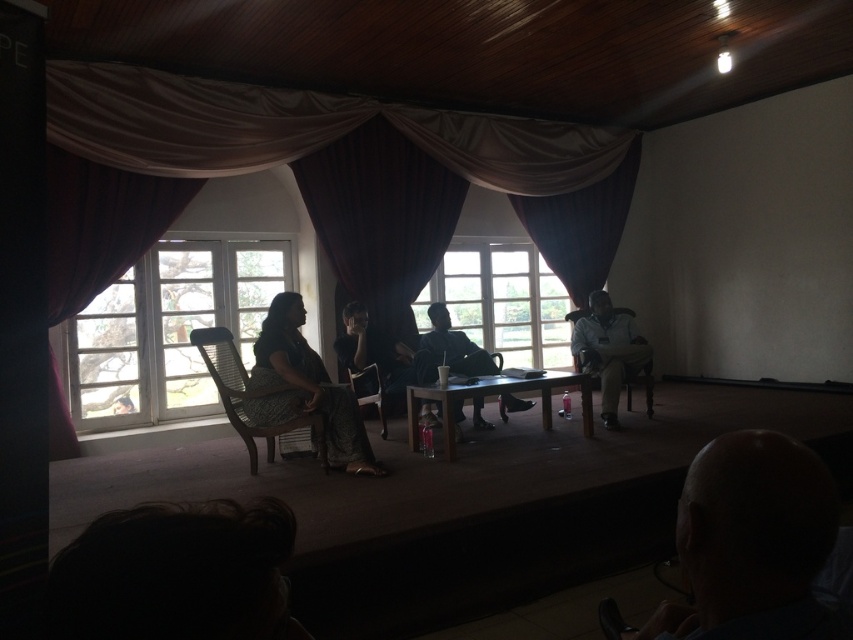
Is point (421, 360) in front of point (439, 317)?

Yes.

The height and width of the screenshot is (640, 853). In order to click on matte black shirt at center in this screenshot , I will do `click(376, 353)`.

Which of these two, transparent glass window at center or wooden textured chair at center, stands taller?

transparent glass window at center

Who is more distant from viewer, [527,292] or [374,396]?

Positioned behind is point [527,292].

Image resolution: width=853 pixels, height=640 pixels. Find the location of `transparent glass window at center`. transparent glass window at center is located at coordinates (502, 301).

Describe the element at coordinates (100, 225) in the screenshot. I see `dark velvet curtain at left` at that location.

Between dark velvet curtain at left and matte black shirt at center, which one is positioned higher?

Positioned higher is dark velvet curtain at left.

The height and width of the screenshot is (640, 853). What do you see at coordinates (100, 225) in the screenshot?
I see `dark velvet curtain at left` at bounding box center [100, 225].

In order to click on dark velvet curtain at left in this screenshot , I will do `click(100, 225)`.